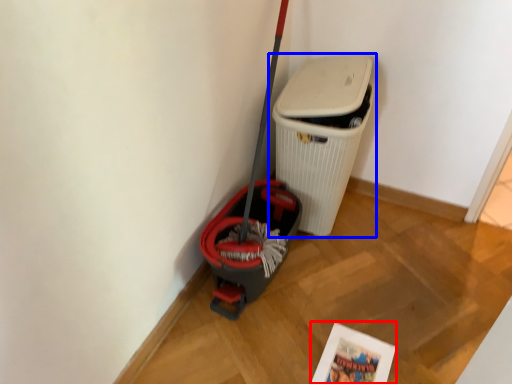
Question: Which object appears closest to the camera in this image, comic book (highlighted by a red box) or waste container (highlighted by a blue box)?

Choices:
 (A) comic book
 (B) waste container

Answer: (A)